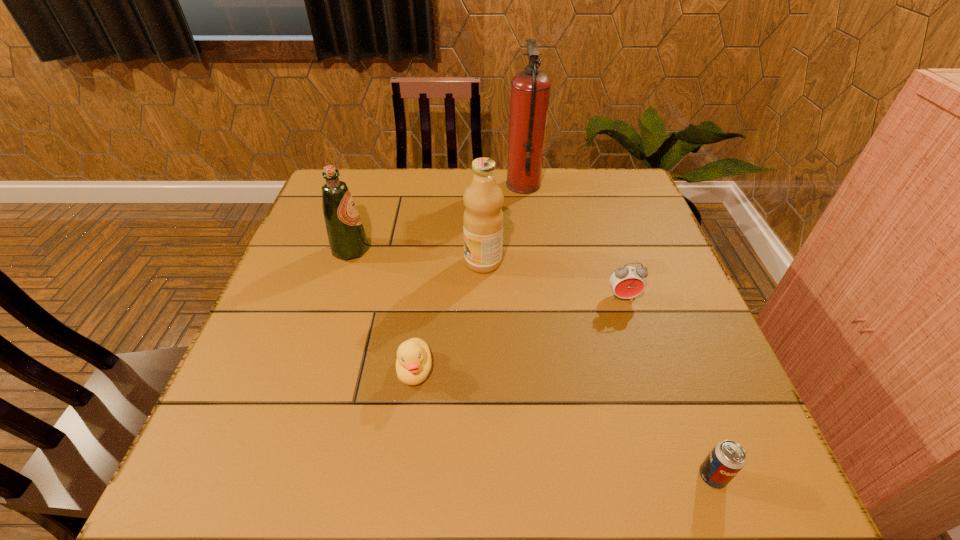
The image size is (960, 540). Find the location of `object that is at the far edge`. object that is at the far edge is located at coordinates (530, 89).

Find the location of a particular element. This screenshot has width=960, height=540. object located at the near edge is located at coordinates (727, 458).

I want to click on object present at the left edge, so click(347, 239).

Identify the location of alarm clock that is at the right edge. (627, 282).

At what (x,y) coordinates should I click in order to perform the action: click on beer can at the right edge. Please return your answer as a coordinate pair (x, y). This screenshot has height=540, width=960. Looking at the image, I should click on (727, 458).

Locate an element on the screen. Image resolution: width=960 pixels, height=540 pixels. object at the near right corner is located at coordinates (727, 458).

Where is `vacant space at the far edge of the desktop`? The height and width of the screenshot is (540, 960). vacant space at the far edge of the desktop is located at coordinates click(x=389, y=208).

You are a GUI agent. You are given a task and a screenshot of the screen. Output one action in this format:
    pyautogui.click(x=<x>, y=<y>)
    Task: Click on the vacant area at the near edge of the desktop
    The height and width of the screenshot is (540, 960).
    Given the screenshot: What is the action you would take?
    pyautogui.click(x=541, y=460)

Where is `free space at the left edge of the desktop`? The image size is (960, 540). free space at the left edge of the desktop is located at coordinates (243, 387).

Identify the location of vacant space at the right edge of the desktop. (654, 273).